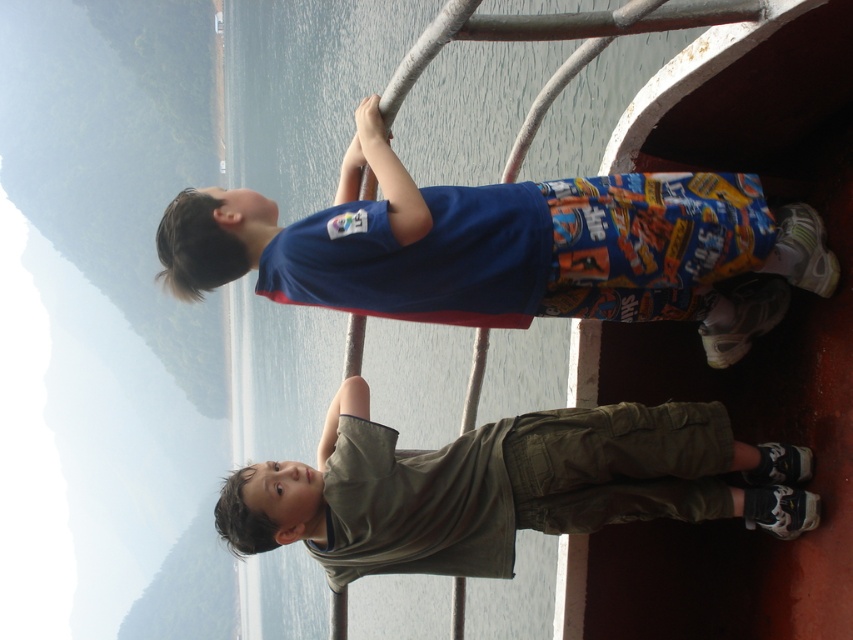
You are a photographer trying to capture the boy in the blue cotton shirt at upper center. You notice a point marked at coordinates (508, 248). Where is this point located relative to the boy in the blue cotton shirt at upper center?

The point at coordinates (508, 248) is located on the blue cotton shirt at upper center.

You are on a boat deck and want to place two buoys at the coordinates point (398, 268) and point (672, 444). Which buoy will appear closer to you when viewed from your current position?

The buoy placed at point (398, 268) will appear closer to you because it is closer to the viewer than point (672, 444) according to the coordinates provided.